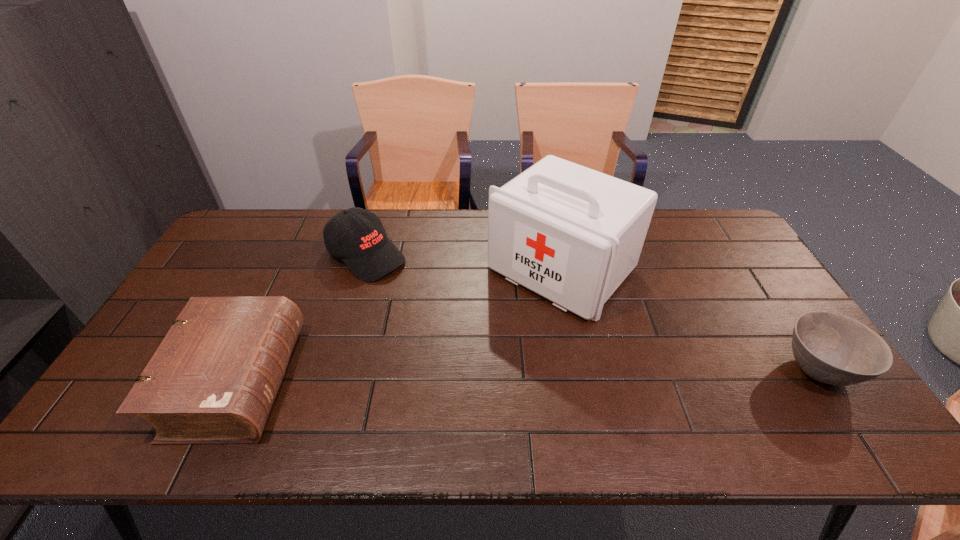
Find the location of a particular element. The image size is (960, 540). free space between the Bible and the tallest object is located at coordinates (399, 326).

I want to click on vacant space that's between the third object from left to right and the baseball cap, so click(x=464, y=263).

The width and height of the screenshot is (960, 540). I want to click on vacant area that lies between the shortest object and the Bible, so click(527, 375).

Identify which object is located as the second nearest to the rightmost object. Please provide its 2D coordinates. Your answer should be formatted as a tuple, i.e. [(x, y)], where the tuple contains the x and y coordinates of a point satisfying the conditions above.

[(357, 236)]

Where is `object that stands as the second closest to the baseball cap`? object that stands as the second closest to the baseball cap is located at coordinates (571, 234).